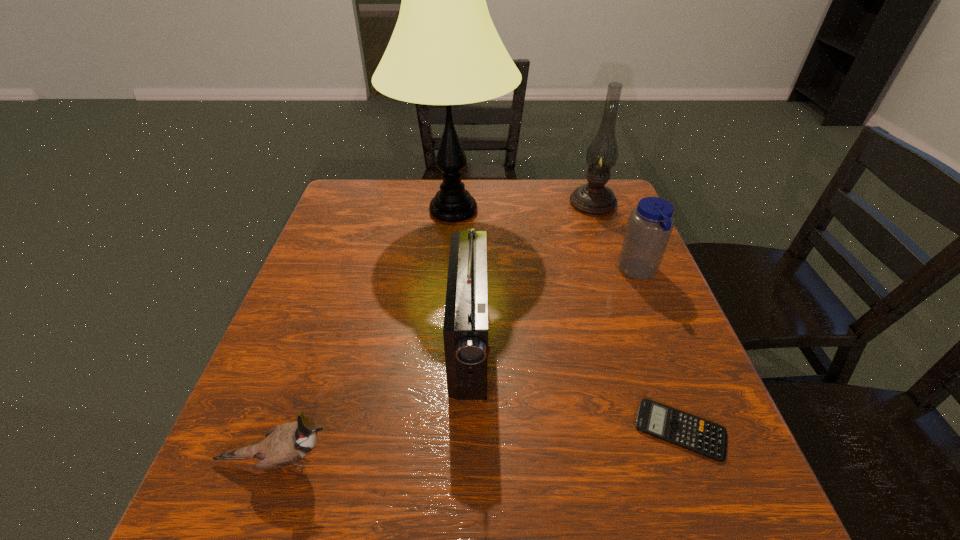
Locate an element on the screen. the tallest object is located at coordinates (445, 50).

This screenshot has height=540, width=960. I want to click on the second tallest object, so click(x=594, y=198).

You are a GUI agent. You are given a task and a screenshot of the screen. Output one action in this format:
    pyautogui.click(x=<x>, y=<y>)
    Task: Click on the third tallest object
    This screenshot has width=960, height=540.
    Given the screenshot: What is the action you would take?
    pyautogui.click(x=465, y=332)

The width and height of the screenshot is (960, 540). I want to click on the third farthest object, so click(650, 224).

Where is `the fourth tallest object`? This screenshot has width=960, height=540. the fourth tallest object is located at coordinates (650, 224).

Identify the location of the fifth tallest object. (285, 444).

I want to click on the shortest object, so click(x=693, y=433).

Where is `vacant space located on the right of the lamp`? This screenshot has height=540, width=960. vacant space located on the right of the lamp is located at coordinates (552, 211).

Locate an element on the screen. free space located on the front of the second tallest object is located at coordinates (607, 242).

Locate an element on the screen. This screenshot has width=960, height=540. vacant space situated on the front-facing side of the radio receiver is located at coordinates (517, 343).